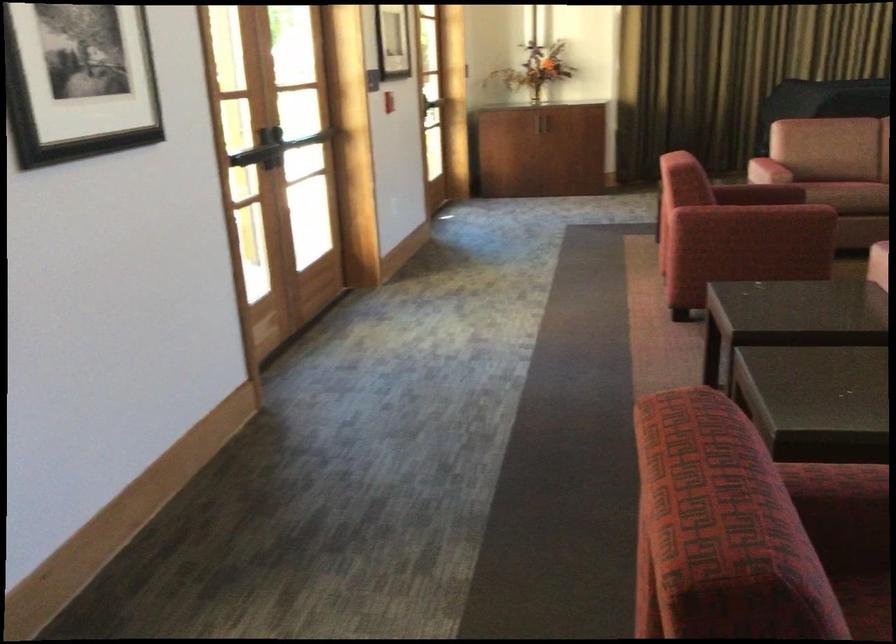
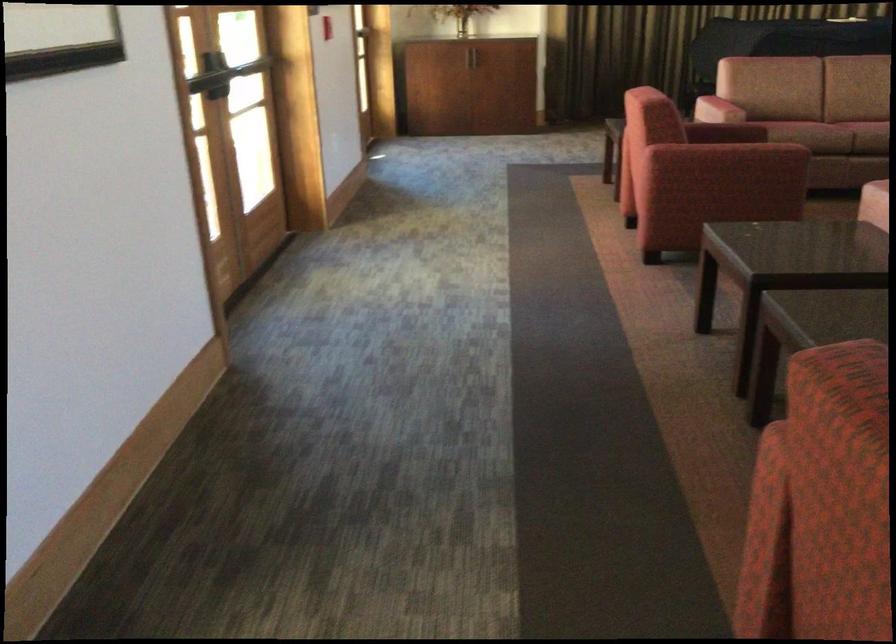
The images are taken continuously from a first-person perspective. In which direction are you moving?

The cameraman moved toward left, forward.